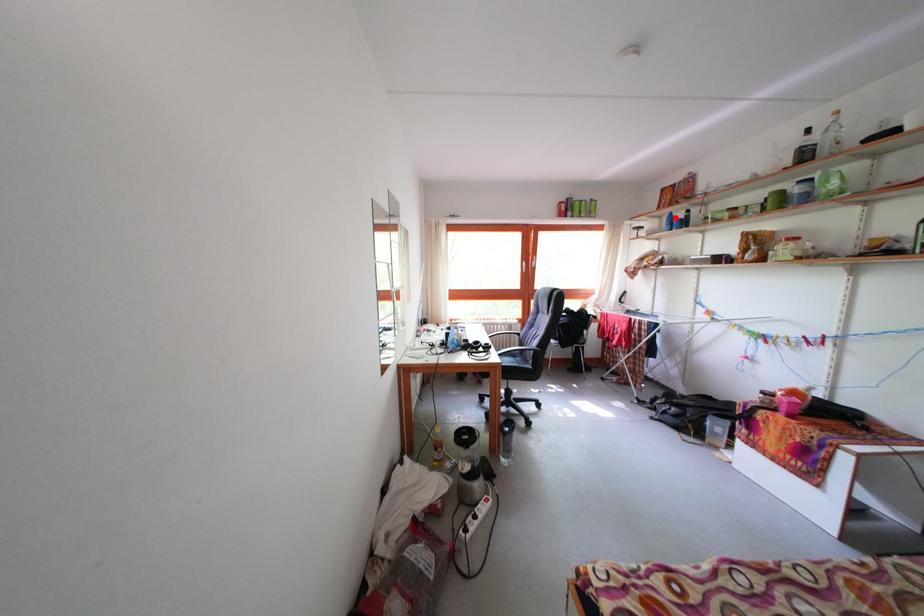
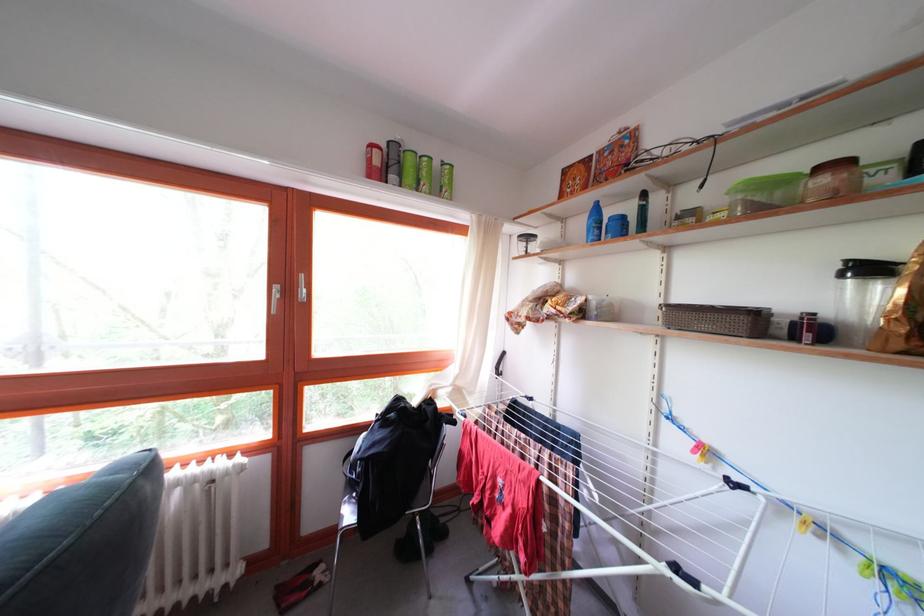
The point at the highlighted location is marked in the first image. Where is the corresponding point in the second image?

(598, 204)